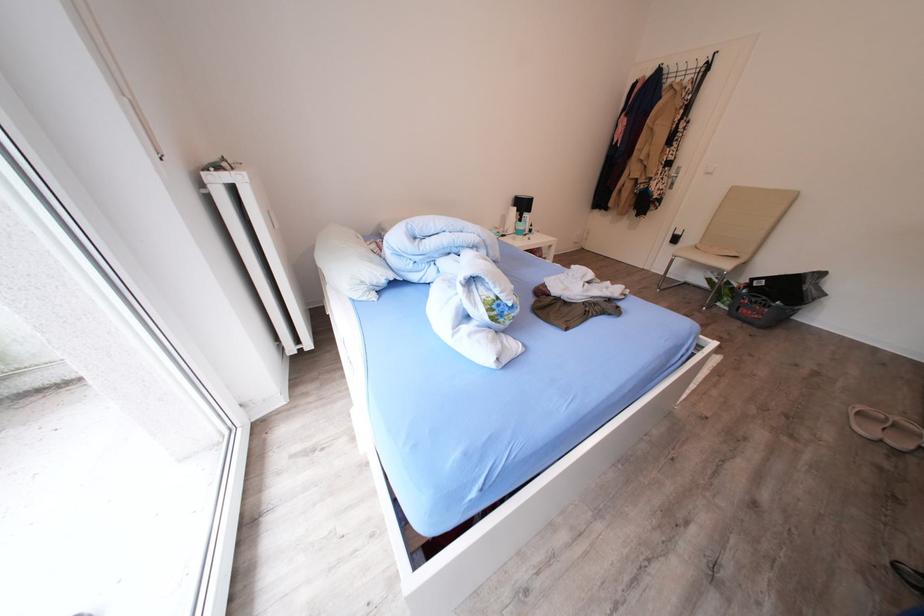
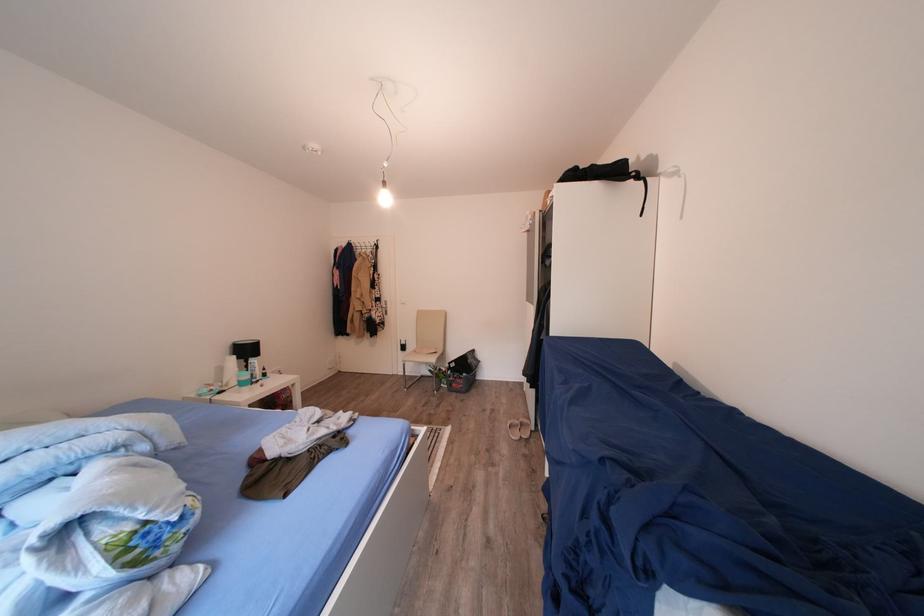
Where in the second image is the point corresponding to (x=738, y=310) from the first image?

(456, 390)